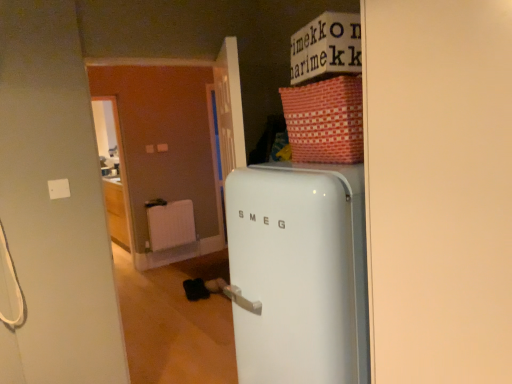
Question: From a real-world perspective, is white matte radiator at center physically below red woven basket at upper right?

Choices:
 (A) yes
 (B) no

Answer: (A)

Question: From the image's perspective, is white matte radiator at center under red woven basket at upper right?

Choices:
 (A) yes
 (B) no

Answer: (A)

Question: Is white matte radiator at center aimed at red woven basket at upper right?

Choices:
 (A) no
 (B) yes

Answer: (B)

Question: Can you confirm if white matte radiator at center is positioned to the right of red woven basket at upper right?

Choices:
 (A) yes
 (B) no

Answer: (B)

Question: Does white matte radiator at center have a lesser width compared to red woven basket at upper right?

Choices:
 (A) no
 (B) yes

Answer: (B)

Question: Relative to white glossy refrigerator at center, is red woven basket at upper right in front or behind?

Choices:
 (A) behind
 (B) front

Answer: (A)

Question: Based on their sizes in the image, would you say red woven basket at upper right is bigger or smaller than white glossy refrigerator at center?

Choices:
 (A) big
 (B) small

Answer: (B)

Question: Is point (355, 89) positioned closer to the camera than point (229, 198)?

Choices:
 (A) farther
 (B) closer

Answer: (B)

Question: Visually, is red woven basket at upper right positioned to the left or to the right of white glossy refrigerator at center?

Choices:
 (A) left
 (B) right

Answer: (A)

Question: Is point (314, 147) closer or farther from the camera than point (158, 230)?

Choices:
 (A) farther
 (B) closer

Answer: (B)

Question: In the image, is red woven basket at upper right positioned in front of or behind white matte radiator at center?

Choices:
 (A) behind
 (B) front

Answer: (B)

Question: Do you think red woven basket at upper right is within white matte radiator at center, or outside of it?

Choices:
 (A) inside
 (B) outside

Answer: (B)

Question: Is red woven basket at upper right taller or shorter than white matte radiator at center?

Choices:
 (A) short
 (B) tall

Answer: (A)

Question: From the image's perspective, is white glossy refrigerator at center positioned above or below white matte radiator at center?

Choices:
 (A) above
 (B) below

Answer: (B)

Question: Would you say white glossy refrigerator at center is inside or outside white matte radiator at center?

Choices:
 (A) outside
 (B) inside

Answer: (A)